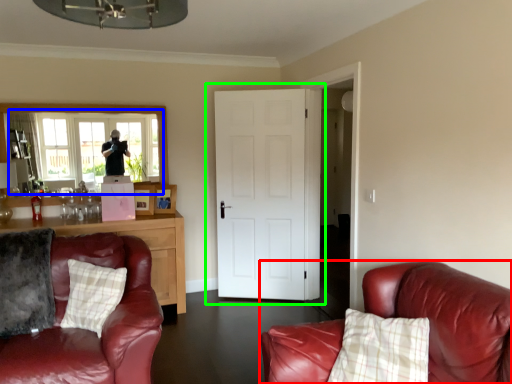
Question: Estimate the real-world distances between objects in this image. Which object is closer to studio couch (highlighted by a red box), window (highlighted by a blue box) or door (highlighted by a green box)?

Choices:
 (A) window
 (B) door

Answer: (B)